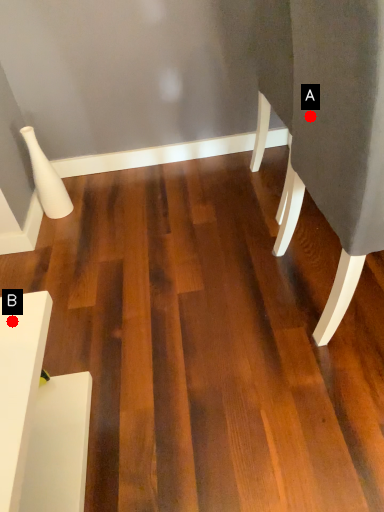
Question: Two points are circled on the image, labeled by A and B beside each circle. Which point is farther from the camera taking this photo?

Choices:
 (A) A is further
 (B) B is further

Answer: (A)